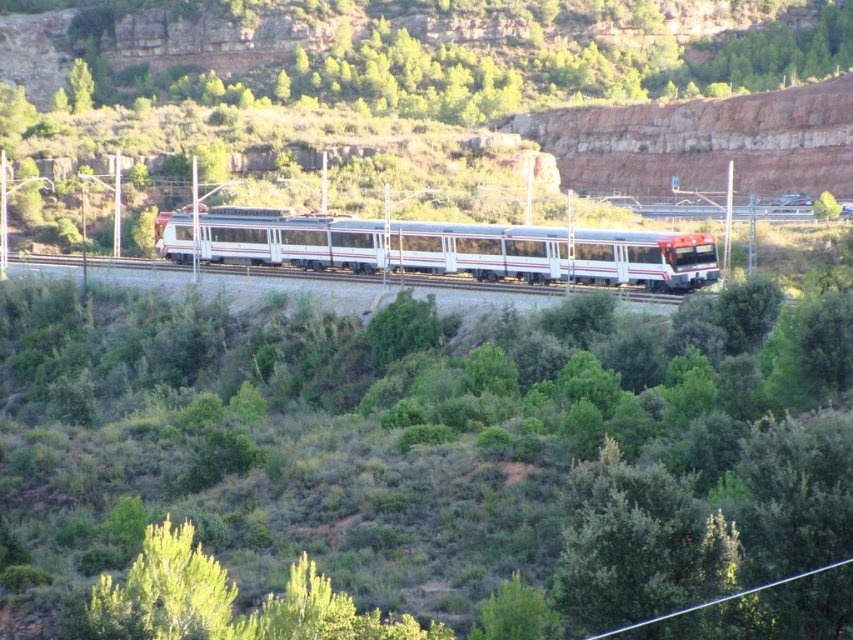
Question: Can you confirm if white glossy train at center is wider than white glossy train track at center?

Choices:
 (A) yes
 (B) no

Answer: (B)

Question: Is the position of green leafy shrub at center more distant than that of white glossy train at center?

Choices:
 (A) yes
 (B) no

Answer: (B)

Question: Is white glossy train at center above white glossy train track at center?

Choices:
 (A) no
 (B) yes

Answer: (B)

Question: Which point is closer to the camera?

Choices:
 (A) (271, 410)
 (B) (672, 241)

Answer: (A)

Question: Which point is closer to the camera?

Choices:
 (A) (407, 508)
 (B) (622, 257)
 (C) (276, 269)

Answer: (A)

Question: Which of the following is the closest to the observer?

Choices:
 (A) white glossy train at center
 (B) green leafy shrub at center

Answer: (B)